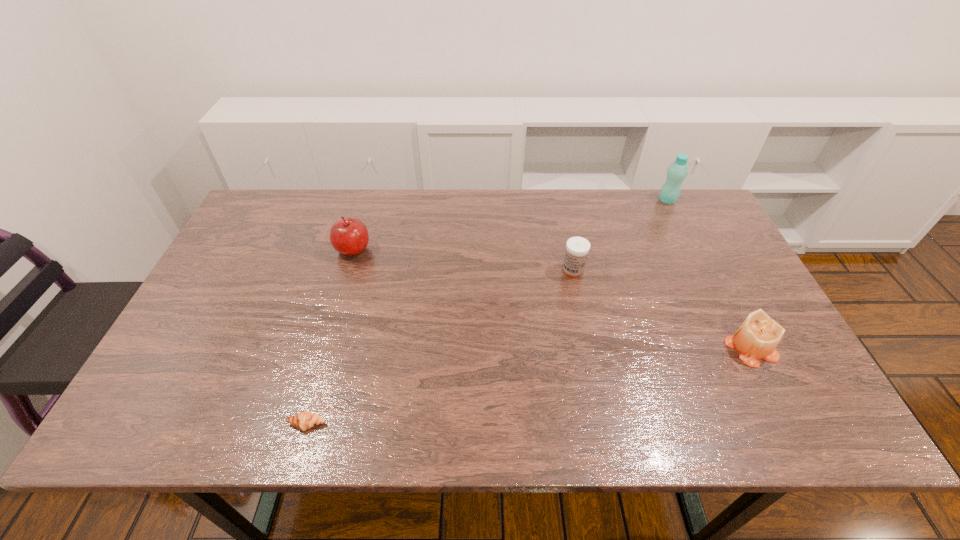
The image size is (960, 540). What are the coordinates of `free space that is in between the fourth farthest object and the shortest object` in the screenshot? It's located at (529, 387).

The width and height of the screenshot is (960, 540). What are the coordinates of `vacant area that lies between the fourth nearest object and the third object from left to right` in the screenshot? It's located at (463, 260).

I want to click on object that is the fourth closest to the candle, so click(349, 236).

Identify which object is located as the second nearest to the farthest object. Please provide its 2D coordinates. Your answer should be formatted as a tuple, i.e. [(x, y)], where the tuple contains the x and y coordinates of a point satisfying the conditions above.

[(757, 337)]

I want to click on free space that satisfies the following two spatial constraints: 1. on the front side of the second farthest object; 2. on the left side of the third farthest object, so click(347, 271).

Image resolution: width=960 pixels, height=540 pixels. I want to click on free space that satisfies the following two spatial constraints: 1. on the front side of the candle; 2. on the left side of the medicine, so click(x=589, y=349).

At what (x,y) coordinates should I click in order to perform the action: click on free location that satisfies the following two spatial constraints: 1. on the front side of the fourth farthest object; 2. on the right side of the medicine. Please return your answer as a coordinate pair (x, y). This screenshot has width=960, height=540. Looking at the image, I should click on (589, 349).

You are a GUI agent. You are given a task and a screenshot of the screen. Output one action in this format:
    pyautogui.click(x=<x>, y=<y>)
    Task: Click on the free space in the image that satisfies the following two spatial constraints: 1. on the front side of the third object from right to left; 2. on the right side of the candle
    Image resolution: width=960 pixels, height=540 pixels.
    Given the screenshot: What is the action you would take?
    pos(589,349)

In order to click on free space that satisfies the following two spatial constraints: 1. on the front side of the second farthest object; 2. on the right side of the third object from left to right in this screenshot , I will do `click(347, 271)`.